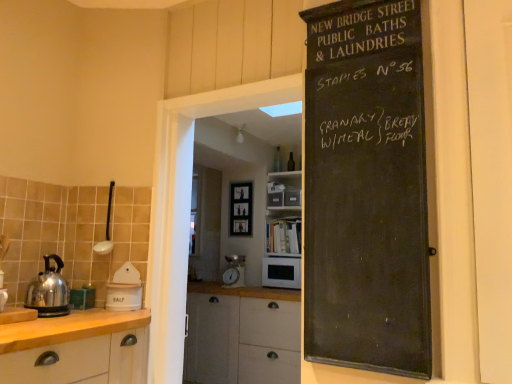
Question: From a real-world perspective, is black chalkboard at right below white ceramic salt container at left, marked as the second appliance in a top-to-bottom arrangement?

Choices:
 (A) no
 (B) yes

Answer: (A)

Question: Considering the relative sizes of black chalkboard at right and white ceramic salt container at left, the 1th appliance from the bottom, in the image provided, is black chalkboard at right taller than white ceramic salt container at left, the 1th appliance from the bottom,?

Choices:
 (A) no
 (B) yes

Answer: (B)

Question: Is black chalkboard at right facing towards white ceramic salt container at left, marked as the second appliance in a top-to-bottom arrangement?

Choices:
 (A) yes
 (B) no

Answer: (B)

Question: Considering the relative sizes of black chalkboard at right and white ceramic salt container at left, the 1th appliance from the bottom, in the image provided, is black chalkboard at right wider than white ceramic salt container at left, the 1th appliance from the bottom,?

Choices:
 (A) no
 (B) yes

Answer: (A)

Question: Could white ceramic salt container at left, the 1th appliance from the bottom, be considered to be inside black chalkboard at right?

Choices:
 (A) no
 (B) yes

Answer: (A)

Question: Is black chalkboard at right in front of white ceramic salt container at left, marked as the second appliance in a top-to-bottom arrangement?

Choices:
 (A) no
 (B) yes

Answer: (B)

Question: From a real-world perspective, is white matte door at right on polished stainless steel kettle at left?

Choices:
 (A) no
 (B) yes

Answer: (B)

Question: Is white matte door at right outside of polished stainless steel kettle at left?

Choices:
 (A) yes
 (B) no

Answer: (A)

Question: Does white matte door at right turn towards polished stainless steel kettle at left?

Choices:
 (A) yes
 (B) no

Answer: (B)

Question: Is the position of white matte door at right more distant than that of polished stainless steel kettle at left?

Choices:
 (A) yes
 (B) no

Answer: (B)

Question: Can polished stainless steel kettle at left be found inside white matte door at right?

Choices:
 (A) yes
 (B) no

Answer: (B)

Question: Does white matte door at right have a smaller size compared to polished stainless steel kettle at left?

Choices:
 (A) no
 (B) yes

Answer: (B)

Question: From the image's perspective, would you say white matte cabinet at left is positioned over metallic silver coffee machine at center?

Choices:
 (A) yes
 (B) no

Answer: (B)